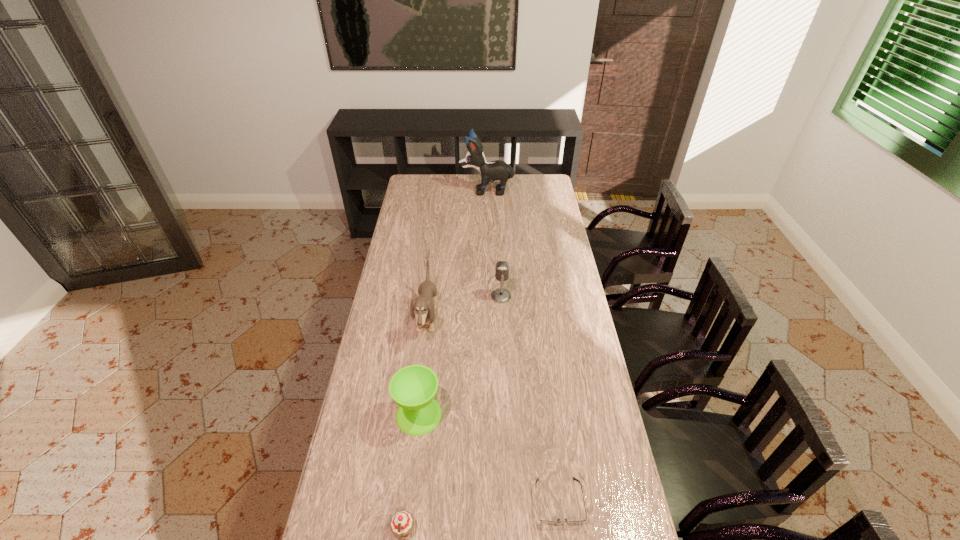
I want to click on free point located at the face of the left puppy, so click(494, 319).

Image resolution: width=960 pixels, height=540 pixels. I want to click on free point located 0.350m on the back of the microphone, so click(498, 241).

You are a GUI agent. You are given a task and a screenshot of the screen. Output one action in this format:
    pyautogui.click(x=<x>, y=<y>)
    Task: Click on the free space located 0.080m on the back of the wineglass
    The height and width of the screenshot is (540, 960).
    Given the screenshot: What is the action you would take?
    pyautogui.click(x=423, y=376)

In order to click on object positioned at the far edge in this screenshot , I will do `click(495, 170)`.

Locate an element on the screen. The height and width of the screenshot is (540, 960). object present at the left edge is located at coordinates (413, 388).

The image size is (960, 540). What are the coordinates of `object present at the right edge` in the screenshot? It's located at (558, 520).

Find the location of a particular element. This screenshot has width=960, height=540. vacant space at the far edge of the desktop is located at coordinates (454, 192).

Image resolution: width=960 pixels, height=540 pixels. I want to click on vacant region at the left edge of the desktop, so click(x=421, y=213).

Identify the location of vacant area at the right edge of the desktop. This screenshot has width=960, height=540. (532, 208).

The height and width of the screenshot is (540, 960). I want to click on free region at the far left corner of the desktop, so click(x=412, y=178).